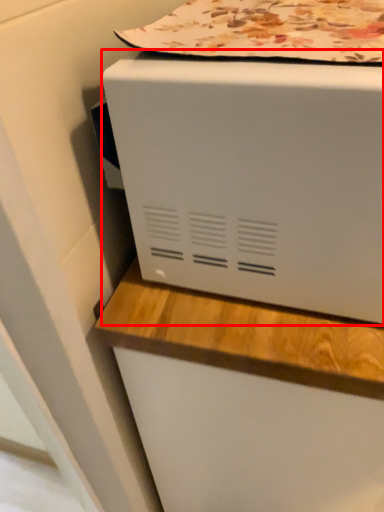
Question: From the image's perspective, what is the correct spatial positioning of home appliance (annotated by the red box) in reference to blanket?

Choices:
 (A) above
 (B) below

Answer: (B)